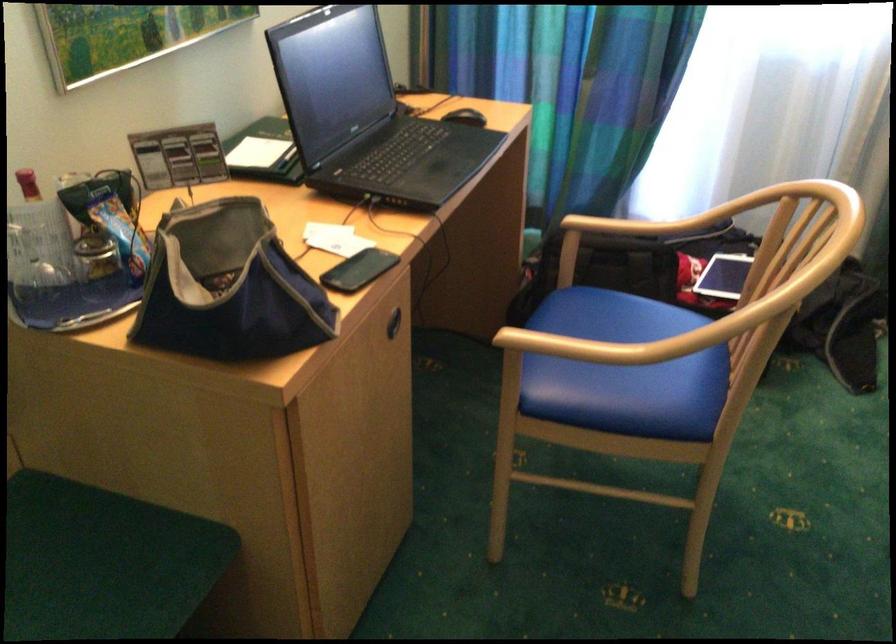
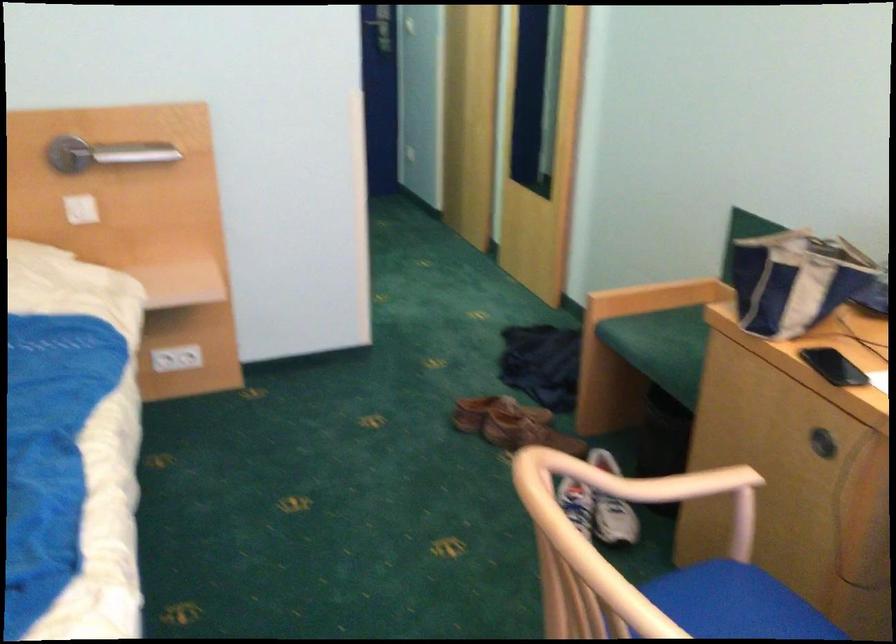
Locate, in the second image, the point that corresponds to (x=254, y=283) in the first image.

(794, 279)